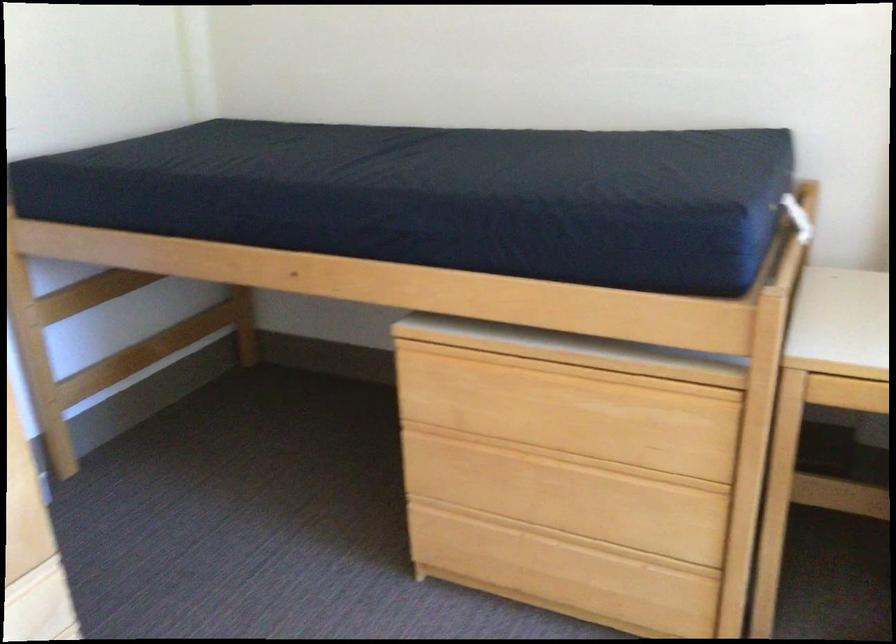
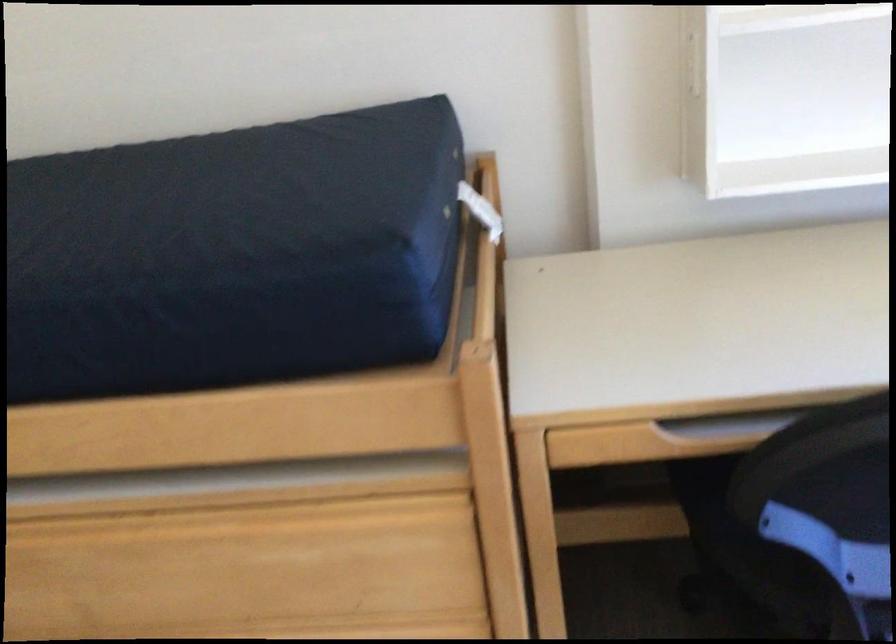
Where in the second image is the point corresponding to point (794, 214) from the first image?

(480, 211)